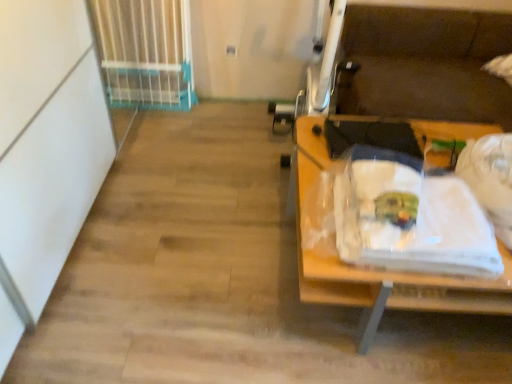
This screenshot has height=384, width=512. What do you see at coordinates (398, 291) in the screenshot?
I see `wooden desk at right` at bounding box center [398, 291].

In order to face wooden desk at right, should I rotate leftwards or rightwards?

Rotate right and turn 19.671 degrees.

Where is `white plastic gate at upper left`? The height and width of the screenshot is (384, 512). white plastic gate at upper left is located at coordinates (145, 53).

Does white fabric at right have a greater width compared to white plastic gate at upper left?

Yes, white fabric at right is wider than white plastic gate at upper left.

Considering the sizes of white fabric at right and white plastic gate at upper left in the image, is white fabric at right bigger or smaller than white plastic gate at upper left?

Considering their sizes, white fabric at right takes up less space than white plastic gate at upper left.

Which is closer to the camera, (370, 163) or (161, 18)?

Point (370, 163) is positioned closer to the camera compared to point (161, 18).

Based on the photo, can you confirm if white fabric at right is positioned to the left of white plastic gate at upper left?

Incorrect, white fabric at right is not on the left side of white plastic gate at upper left.

Is wooden desk at right far away from white fabric at right?

No, wooden desk at right is in close proximity to white fabric at right.

Is wooden desk at right looking in the opposite direction of white fabric at right?

wooden desk at right does not have its back to white fabric at right.

Looking at this image, from a real-world perspective, is wooden desk at right positioned under white fabric at right based on gravity?

Indeed, from a real-world perspective, wooden desk at right is positioned beneath white fabric at right.

Considering the relative positions of wooden desk at right and white fabric at right in the image provided, is wooden desk at right in front of white fabric at right?

That is False.

Where is `radiator behind the white fabric at right`? radiator behind the white fabric at right is located at coordinates (145, 53).

Is white plastic gate at upper left wider than white fabric at right?

Incorrect, the width of white plastic gate at upper left does not surpass that of white fabric at right.

Is white plastic gate at upper left spatially inside white fabric at right, or outside of it?

white plastic gate at upper left is not enclosed by white fabric at right.

Based on their sizes in the image, would you say white plastic gate at upper left is bigger or smaller than white fabric at right?

white plastic gate at upper left is bigger than white fabric at right.

Is white plastic gate at upper left not close to wooden desk at right?

white plastic gate at upper left is far away from wooden desk at right.

In the scene shown: Considering the sizes of white plastic gate at upper left and wooden desk at right in the image, is white plastic gate at upper left taller or shorter than wooden desk at right?

In the image, white plastic gate at upper left appears to be taller than wooden desk at right.

Is white plastic gate at upper left to the left of wooden desk at right from the viewer's perspective?

Yes, white plastic gate at upper left is to the left of wooden desk at right.

Can you confirm if white plastic gate at upper left is smaller than wooden desk at right?

Correct, white plastic gate at upper left occupies less space than wooden desk at right.

Which of these two, wooden desk at right or white plastic gate at upper left, is thinner?

Thinner between the two is white plastic gate at upper left.

From the image's perspective, does wooden desk at right appear lower than white plastic gate at upper left?

Yes, from the image's perspective, wooden desk at right is beneath white plastic gate at upper left.

Would you consider wooden desk at right to be distant from white plastic gate at upper left?

That's right, there is a large distance between wooden desk at right and white plastic gate at upper left.

Is wooden desk at right turned away from white plastic gate at upper left?

No, wooden desk at right's orientation is not away from white plastic gate at upper left.

Is white fabric at right to the left or to the right of wooden desk at right in the image?

Clearly, white fabric at right is on the left of wooden desk at right in the image.

Does white fabric at right have a lesser height compared to wooden desk at right?

Indeed, white fabric at right has a lesser height compared to wooden desk at right.

From the image's perspective, would you say white fabric at right is shown under wooden desk at right?

Incorrect, from the image's perspective, white fabric at right is higher than wooden desk at right.

Would you say white fabric at right is inside or outside wooden desk at right?

white fabric at right is spatially situated outside wooden desk at right.

Identify the location of waste above the white plastic gate at upper left (from a real-world perspective). (409, 217).

I want to click on desk to the right of white fabric at right, so click(x=398, y=291).

Which object lies nearer to the anchor point white plastic gate at upper left, white fabric at right or wooden desk at right?

white fabric at right is closer to white plastic gate at upper left.

From the image, which object appears to be farther from wooden desk at right, white plastic gate at upper left or white fabric at right?

Among the two, white plastic gate at upper left is located further to wooden desk at right.

From the image, which object appears to be nearer to white plastic gate at upper left, wooden desk at right or white fabric at right?

white fabric at right is positioned closer to the anchor white plastic gate at upper left.

From the image, which object appears to be farther from white fabric at right, wooden desk at right or white plastic gate at upper left?

white plastic gate at upper left is further to white fabric at right.

From the image, which object appears to be farther from wooden desk at right, white fabric at right or white plastic gate at upper left?

Based on the image, white plastic gate at upper left appears to be further to wooden desk at right.

Based on the photo, which object lies further to the anchor point white fabric at right, white plastic gate at upper left or wooden desk at right?

white plastic gate at upper left lies further to white fabric at right than the other object.

Locate an element on the screen. Image resolution: width=512 pixels, height=384 pixels. waste between white plastic gate at upper left and wooden desk at right from left to right is located at coordinates (409, 217).